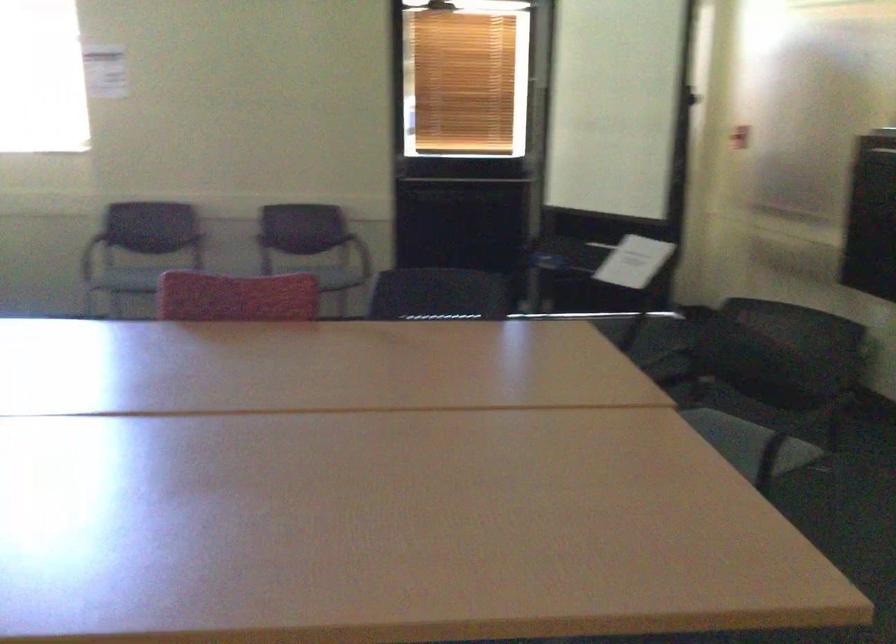
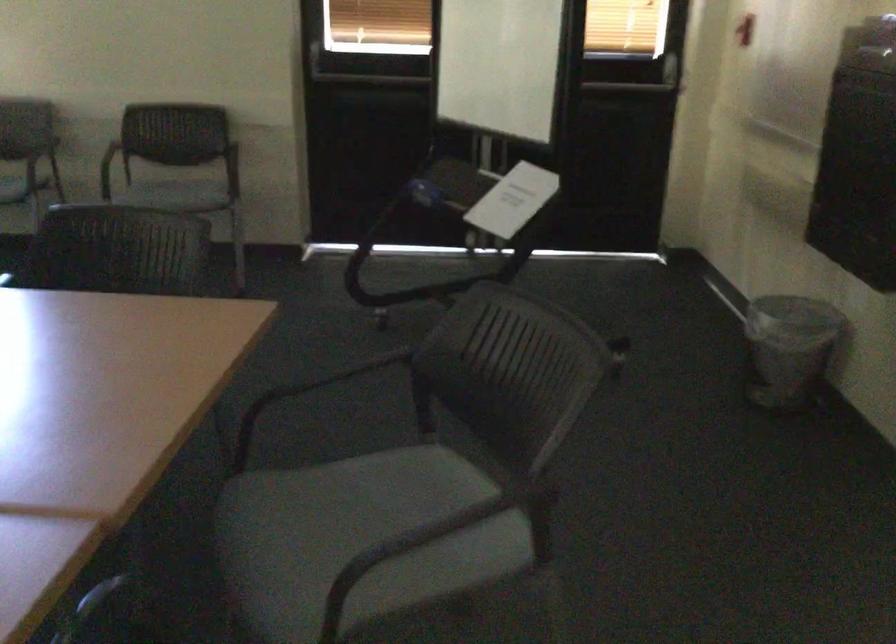
Question: I am providing you with two images of the same scene from different viewpoints. After the viewpoint changes to image2, which objects are now occluded?

Choices:
 (A) chair armrest
 (B) chair sitting surface
 (C) small trash can
 (D) none of these

Answer: (D)